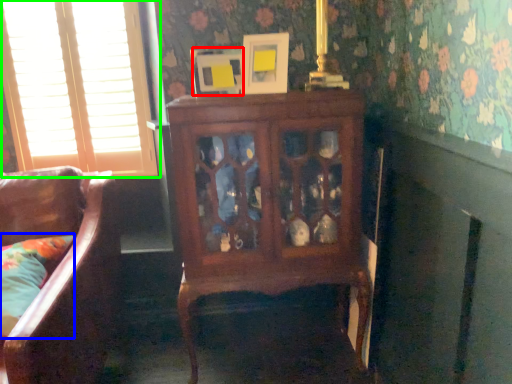
Question: Based on their relative distances, which object is nearer to picture frame (highlighted by a red box)? Choose from pillow (highlighted by a blue box) and window (highlighted by a green box).

Choices:
 (A) pillow
 (B) window

Answer: (B)